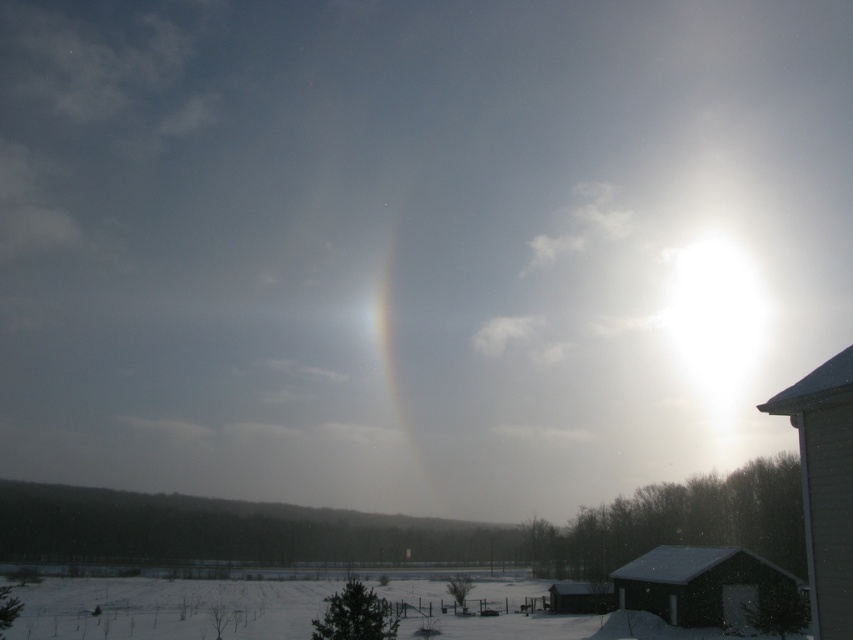
Question: Is gray wood cabin at right positioned in front of white translucent ring at center?

Choices:
 (A) no
 (B) yes

Answer: (B)

Question: Among these points, which one is farthest from the camera?

Choices:
 (A) (828, 624)
 (B) (695, 577)
 (C) (606, 580)
 (D) (381, 352)

Answer: (D)

Question: Which point is farther to the camera?

Choices:
 (A) (398, 196)
 (B) (560, 612)

Answer: (A)

Question: Is the position of gray wood cabin at right less distant than that of dark gray wooden hut at lower right?

Choices:
 (A) no
 (B) yes

Answer: (B)

Question: Is gray wood cabin at right to the right of wooden cabin at lower center from the viewer's perspective?

Choices:
 (A) yes
 (B) no

Answer: (B)

Question: Among these points, which one is farthest from the camera?

Choices:
 (A) (816, 531)
 (B) (749, 593)

Answer: (B)